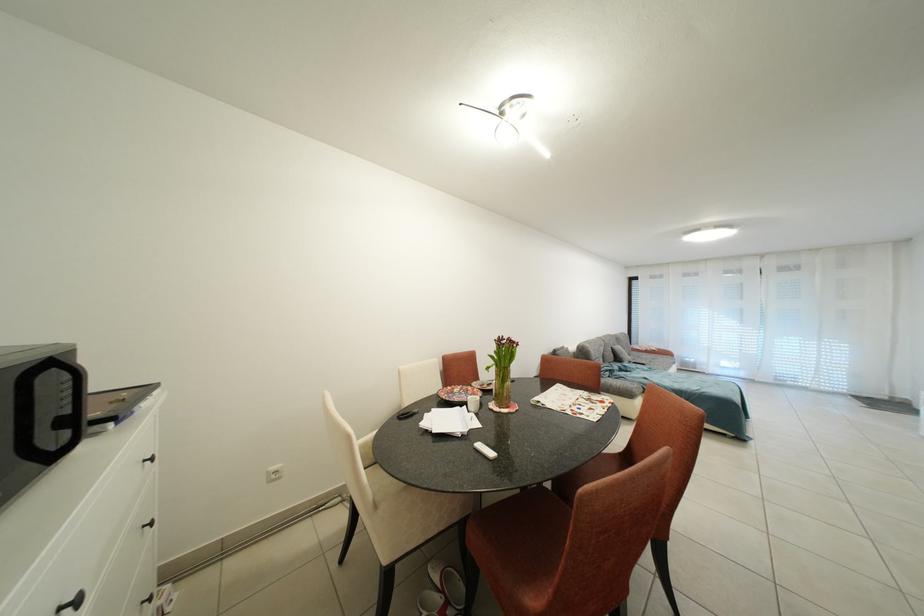
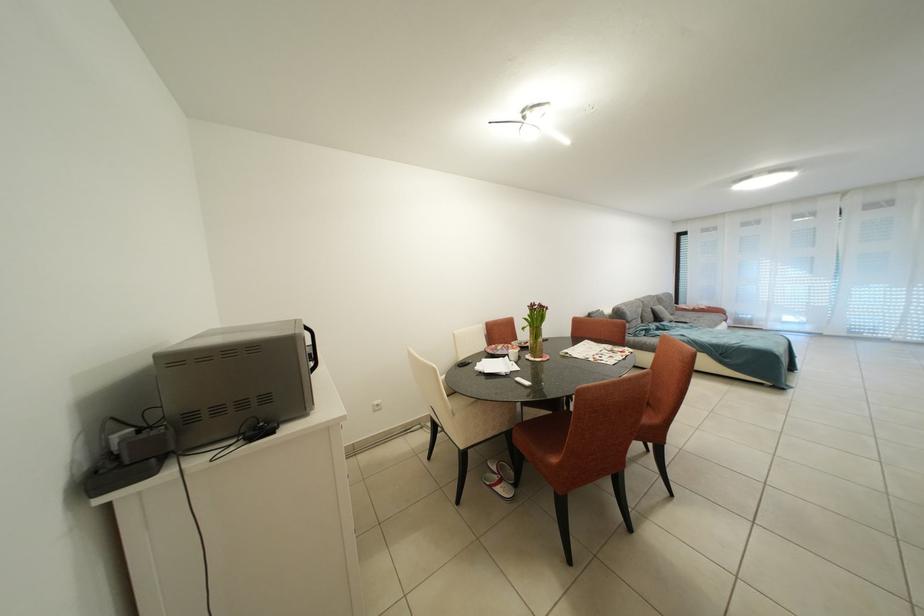
Locate, in the second image, the point that corresponds to the point at 507,345 in the first image.

(540, 310)